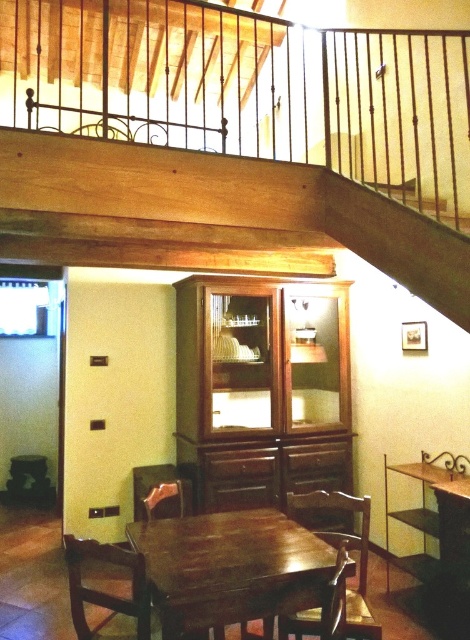
Is point (140, 168) in front of point (336, 502)?

That is True.

Image resolution: width=470 pixels, height=640 pixels. Describe the element at coordinates (233, 140) in the screenshot. I see `wooden at upper center` at that location.

Who is more forward, (219, 266) or (329, 506)?

Point (329, 506) is more forward.

The image size is (470, 640). What are the coordinates of `wooden at upper center` in the screenshot? It's located at (233, 140).

Who is more distant from viewer, [291,620] or [165,504]?

Positioned behind is point [165,504].

Based on the photo, between wooden chair at lower center and wooden chair at lower left, which one appears on the right side from the viewer's perspective?

wooden chair at lower center

Is point (315, 516) positioned after point (173, 506)?

Yes, it is.

At what (x,y) coordinates should I click in order to perform the action: click on wooden chair at lower center. Please return your answer as a coordinate pair (x, y). The image size is (470, 640). Looking at the image, I should click on (339, 545).

Is wooden at upper center closer to the viewer compared to wooden table at center?

That is False.

Is wooden at upper center taller than wooden table at center?

Correct, wooden at upper center is much taller as wooden table at center.

This screenshot has height=640, width=470. Find the location of `wooden at upper center`. wooden at upper center is located at coordinates (233, 140).

The width and height of the screenshot is (470, 640). Identify the location of wooden at upper center. (233, 140).